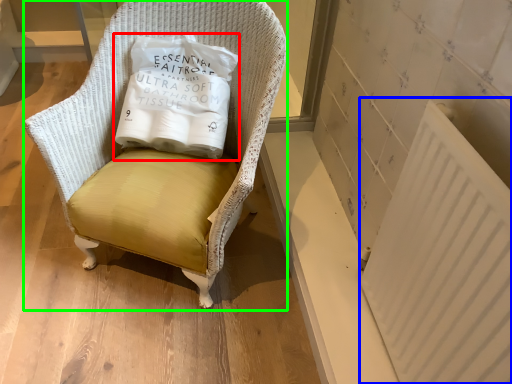
Question: Which object is the farthest from pillow (highlighted by a red box)? Choose among these: radiator (highlighted by a blue box) or chair (highlighted by a green box).

Choices:
 (A) radiator
 (B) chair

Answer: (A)